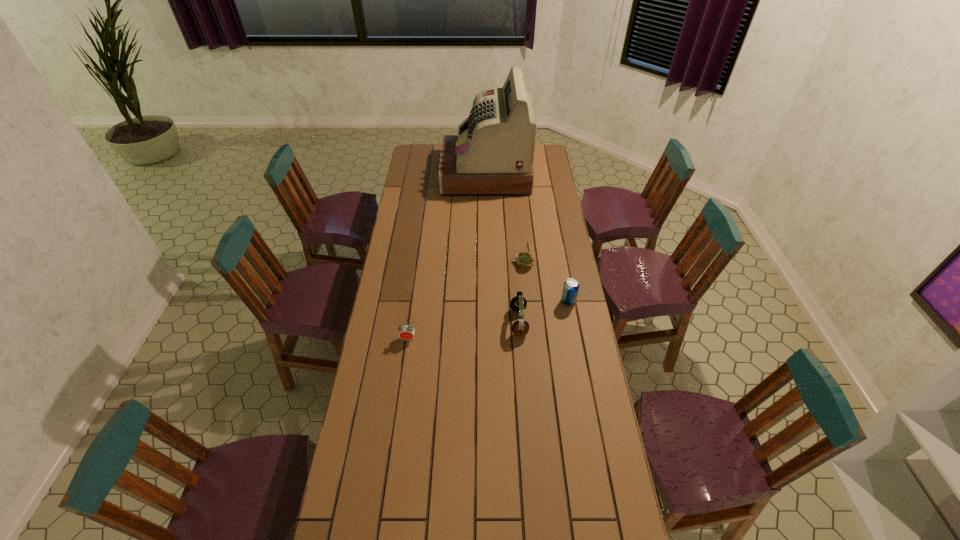
The height and width of the screenshot is (540, 960). What are the coordinates of `blank region between the shortest object and the second farthest object` in the screenshot? It's located at (x=466, y=300).

You are a GUI agent. You are given a task and a screenshot of the screen. Output one action in this format:
    pyautogui.click(x=<x>, y=<y>)
    Task: Click on the empty location between the rightmost object and the tallest object
    
    Given the screenshot: What is the action you would take?
    pyautogui.click(x=527, y=238)

Locate an element on the screen. free area in between the shortest object and the headset is located at coordinates (464, 330).

This screenshot has width=960, height=540. Identify the location of blank region between the shortest object and the beer can. (488, 320).

This screenshot has height=540, width=960. What are the coordinates of `unoccupied position between the headset and the beer can` in the screenshot? It's located at (543, 312).

Select which object appears as the second closest to the compass. Please provide its 2D coordinates. Your answer should be formatted as a tuple, i.e. [(x, y)], where the tuple contains the x and y coordinates of a point satisfying the conditions above.

[(518, 303)]

Where is `object identified as the second closest to the leftmost object`? object identified as the second closest to the leftmost object is located at coordinates (524, 260).

Identify the location of vacant space that satisfies the following two spatial constraints: 1. on the ear cups of the headset; 2. on the face of the leftmost object. The height and width of the screenshot is (540, 960). (520, 339).

What are the coordinates of `free space that satisfies the following two spatial constraints: 1. on the operating side of the tallest object; 2. on the face of the shortest object` in the screenshot? It's located at (488, 339).

The image size is (960, 540). Find the location of `free region that satisfies the following two spatial constraints: 1. with the dial facing the compass; 2. on the left side of the beer can`. free region that satisfies the following two spatial constraints: 1. with the dial facing the compass; 2. on the left side of the beer can is located at coordinates (527, 301).